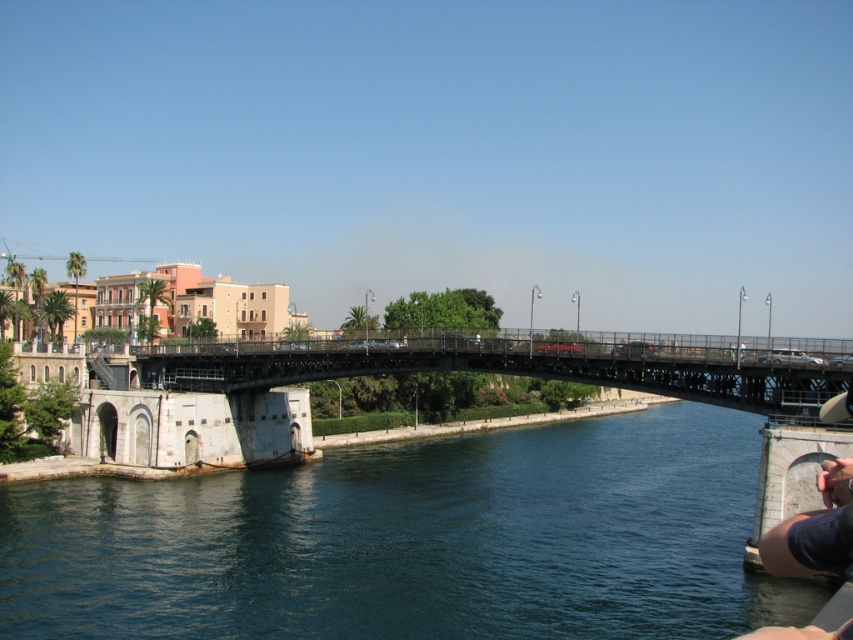
Question: Which of the following is the farthest from the observer?

Choices:
 (A) metallic bridge at center
 (B) deep blue water at center

Answer: (A)

Question: Can you confirm if deep blue water at center is wider than metallic bridge at center?

Choices:
 (A) no
 (B) yes

Answer: (B)

Question: Is deep blue water at center above metallic bridge at center?

Choices:
 (A) yes
 (B) no

Answer: (B)

Question: Which object appears closest to the camera in this image?

Choices:
 (A) metallic bridge at center
 (B) deep blue water at center

Answer: (B)

Question: From the image, what is the correct spatial relationship of deep blue water at center in relation to metallic bridge at center?

Choices:
 (A) below
 (B) above

Answer: (A)